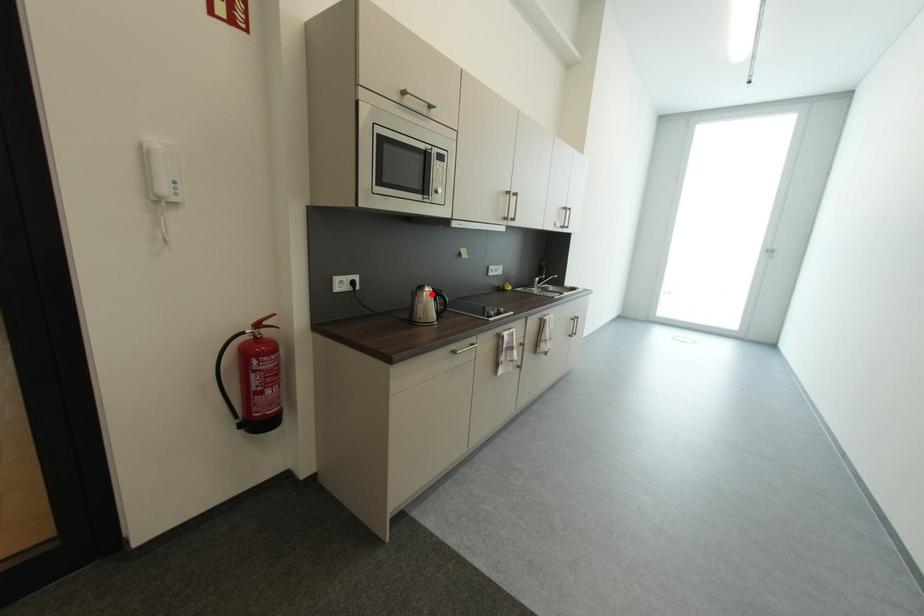
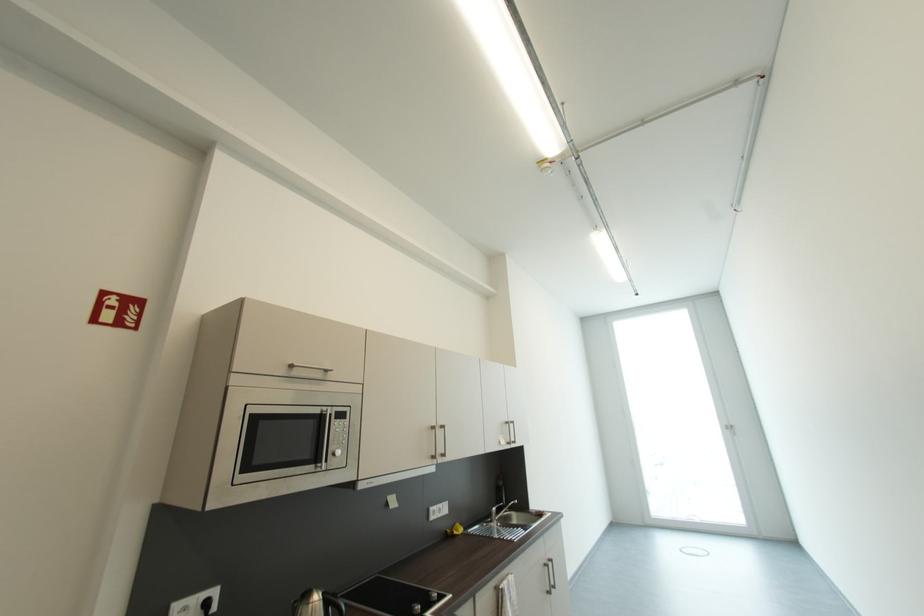
The point at the highlighted location is marked in the first image. Where is the corresponding point in the second image?

(317, 607)